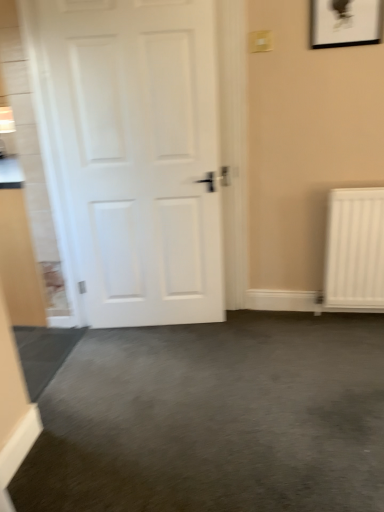
Question: In terms of width, does white matte door at left look wider or thinner when compared to matte black picture frame at upper right?

Choices:
 (A) thin
 (B) wide

Answer: (B)

Question: From a real-world perspective, is white matte door at left physically located above or below matte black picture frame at upper right?

Choices:
 (A) below
 (B) above

Answer: (A)

Question: In terms of height, does white matte door at left look taller or shorter compared to matte black picture frame at upper right?

Choices:
 (A) short
 (B) tall

Answer: (B)

Question: Does point (375, 25) appear closer or farther from the camera than point (69, 203)?

Choices:
 (A) closer
 (B) farther

Answer: (A)

Question: Is matte black picture frame at upper right wider or thinner than white matte door at left?

Choices:
 (A) wide
 (B) thin

Answer: (B)

Question: Is matte black picture frame at upper right taller or shorter than white matte door at left?

Choices:
 (A) tall
 (B) short

Answer: (B)

Question: Is matte black picture frame at upper right to the left or to the right of white matte door at left in the image?

Choices:
 (A) right
 (B) left

Answer: (A)